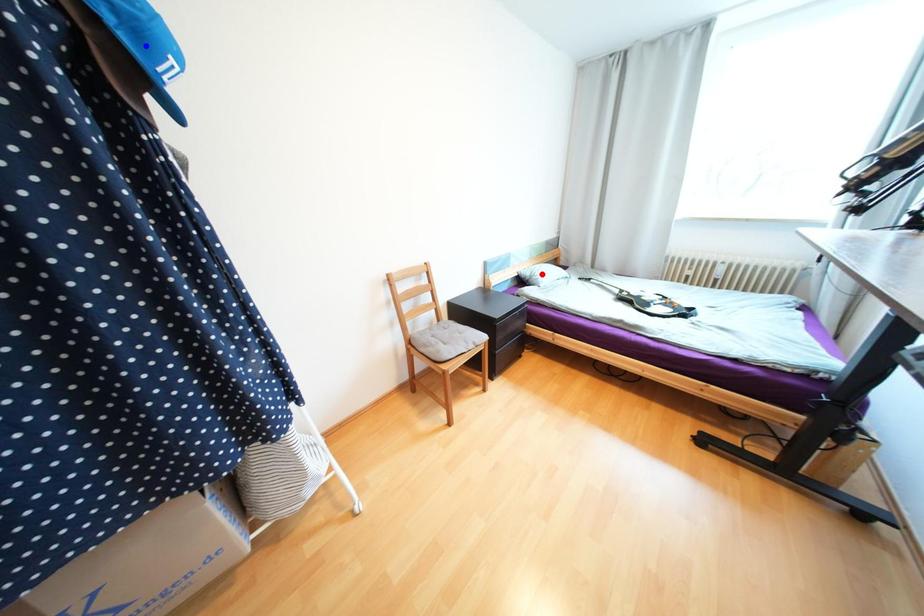
Question: Which of the two points in the image is closer to the camera?

Choices:
 (A) Blue point is closer.
 (B) Red point is closer.

Answer: (A)